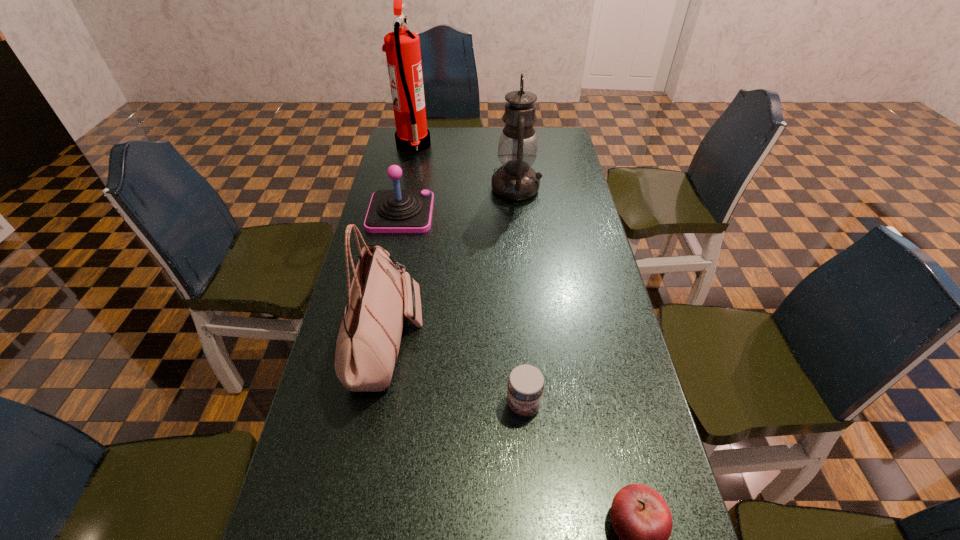
You are a GUI agent. You are given a task and a screenshot of the screen. Output one action in this format:
    pyautogui.click(x=<x>, y=<y>)
    Task: Click on the fire extinguisher
    The image size is (960, 540).
    Given the screenshot: What is the action you would take?
    pyautogui.click(x=402, y=47)

Identify the location of the farthest object. This screenshot has width=960, height=540. (402, 47).

This screenshot has width=960, height=540. In order to click on oil lamp in this screenshot , I will do tap(515, 180).

I want to click on handbag, so click(x=368, y=343).

Identify the location of joystick. This screenshot has height=540, width=960. (390, 211).

Identify the location of jam. (526, 383).

You are a GUI agent. You are given a task and a screenshot of the screen. Output one action in this format:
    pyautogui.click(x=<x>, y=<y>)
    Task: Click on the free space located 0.220m with the nozzle aimed from the tallest object
    The width and height of the screenshot is (960, 540).
    Given the screenshot: What is the action you would take?
    pyautogui.click(x=484, y=146)

Find the location of a particular element. This screenshot has width=960, height=540. free region located on the left of the oil lamp is located at coordinates (406, 188).

In order to click on vacant region located on the side of the handbag with the attached pouch in this screenshot , I will do `click(519, 343)`.

Where is `free space located 0.390m forward from the base of the fourth tallest object`? The height and width of the screenshot is (540, 960). free space located 0.390m forward from the base of the fourth tallest object is located at coordinates (547, 213).